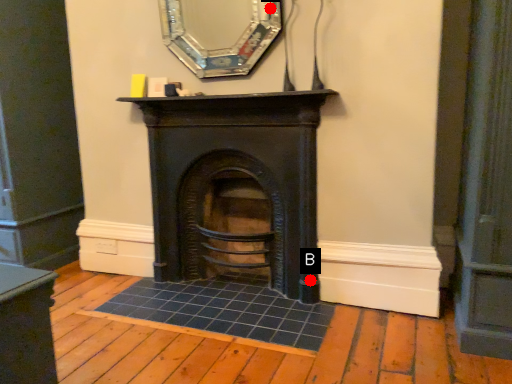
Question: Two points are circled on the image, labeled by A and B beside each circle. Which point appears closest to the camera in this image?

Choices:
 (A) A is closer
 (B) B is closer

Answer: (A)